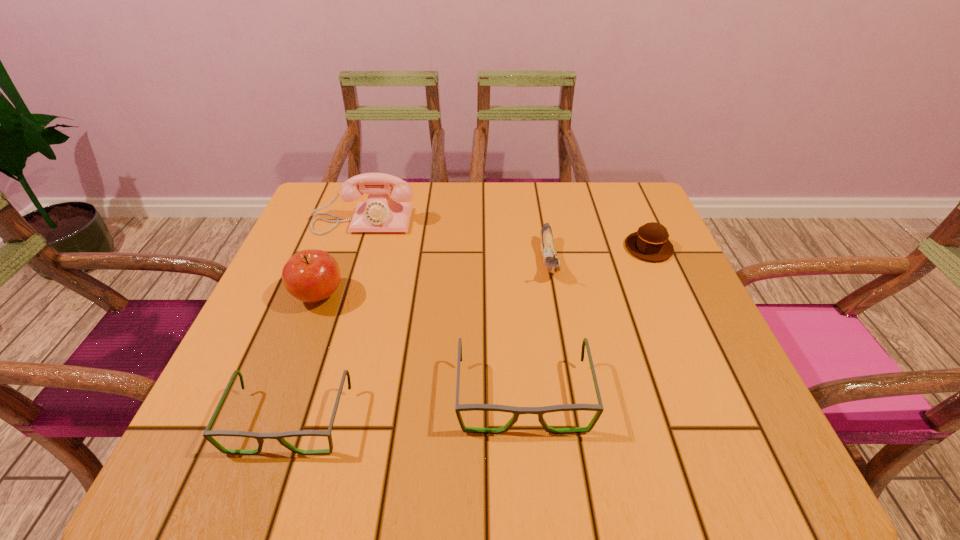
Image resolution: width=960 pixels, height=540 pixels. What are the coordinates of `the shorter spectacles` in the screenshot? It's located at (207, 434).

Find the location of a particular element. This screenshot has width=960, height=540. the right spectacles is located at coordinates (516, 411).

This screenshot has width=960, height=540. I want to click on the fourth tallest object, so click(516, 411).

Image resolution: width=960 pixels, height=540 pixels. What are the coordinates of `telephone` in the screenshot? It's located at (380, 213).

Where is `banana`? This screenshot has height=540, width=960. banana is located at coordinates (550, 258).

At what (x,y) coordinates should I click in order to perform the action: click on the rightmost object. Please return your answer as a coordinate pair (x, y). The image size is (960, 540). Looking at the image, I should click on (650, 242).

The image size is (960, 540). What are the coordinates of `apple` in the screenshot? It's located at (311, 275).

Image resolution: width=960 pixels, height=540 pixels. Find the location of `free space located 0.100m on the dial of the telephone`. free space located 0.100m on the dial of the telephone is located at coordinates (350, 262).

You are a GUI agent. You are given a task and a screenshot of the screen. Output one action in this format:
    pyautogui.click(x=<x>, y=<y>)
    Task: Click on the free space located 0.200m at the stem of the banana
    The width and height of the screenshot is (960, 540).
    Given the screenshot: What is the action you would take?
    pyautogui.click(x=566, y=361)

Find the location of a particular element. This screenshot has height=540, width=960. vacant area situated on the left of the muffin is located at coordinates (505, 248).